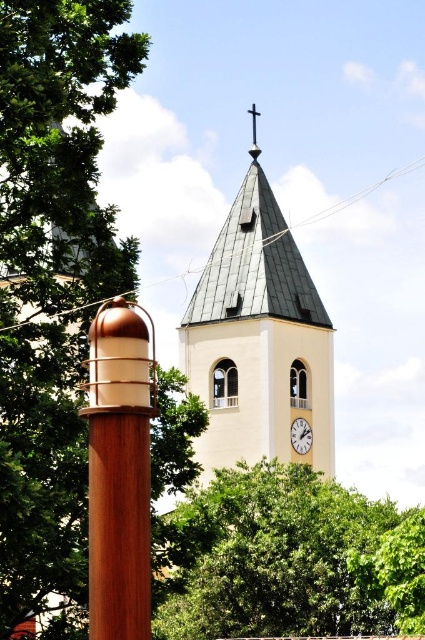
Which is below, wooden post at center or white matte clock at center?

white matte clock at center

Between point (93, 460) and point (300, 426), which one is positioned in front?

Point (93, 460)

Is point (116, 298) farther from camera compared to point (297, 424)?

No, it is in front of (297, 424).

The image size is (425, 640). In order to click on wooden post at center in this screenshot , I will do `click(119, 472)`.

Can you confirm if green leafy tree at upper left is bigger than white matte clock at center?

Yes, green leafy tree at upper left is bigger than white matte clock at center.

Consider the image. Does green leafy tree at upper left have a greater height compared to white matte clock at center?

Yes.

Find the location of a particular element. green leafy tree at upper left is located at coordinates (56, 115).

You are a GUI agent. You are given a task and a screenshot of the screen. Output one action in this format:
    pyautogui.click(x=<x>, y=<y>)
    Task: Click on the white smooth clock tower at center
    The height and width of the screenshot is (640, 425).
    Given the screenshot: What is the action you would take?
    pyautogui.click(x=257, y=339)

Which is above, white smooth clock tower at center or white matte clock at center?

Positioned higher is white smooth clock tower at center.

At what (x,y) coordinates should I click in order to perform the action: click on white smooth clock tower at center. Please return your answer as a coordinate pair (x, y). This screenshot has width=425, height=640. Looking at the image, I should click on (257, 339).

Find the location of a particular element. The image size is (425, 640). white smooth clock tower at center is located at coordinates (257, 339).